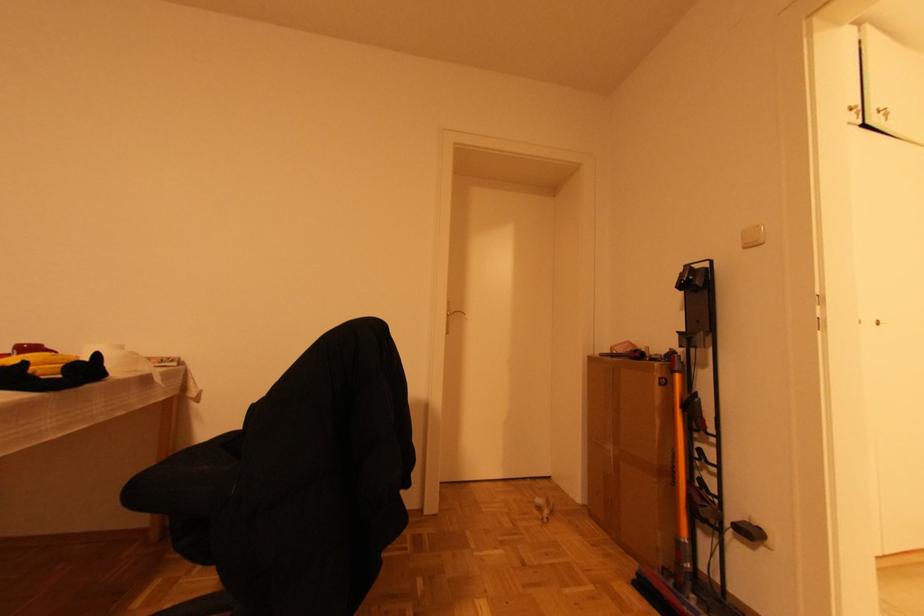
Locate an element on the screen. The width and height of the screenshot is (924, 616). gold door handle is located at coordinates (452, 315).